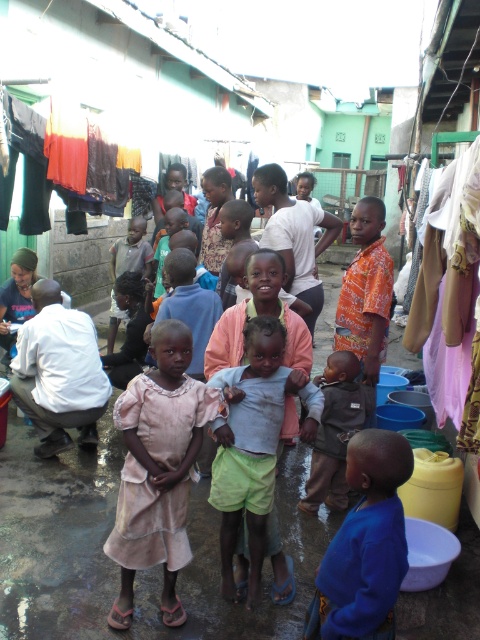
Measure the distance from light green shorts at center to blue cotton shirt at lower right.

light green shorts at center and blue cotton shirt at lower right are 32.95 inches apart from each other.

Who is taller, light green shorts at center or blue cotton shirt at lower right?

Standing taller between the two is light green shorts at center.

What do you see at coordinates (253, 444) in the screenshot?
I see `light green shorts at center` at bounding box center [253, 444].

This screenshot has width=480, height=640. In order to click on light green shorts at center in this screenshot , I will do `click(253, 444)`.

Does light green shorts at center have a smaller size compared to dark gray fabric baby at center?

Yes.

Consider the image. Is light green shorts at center behind dark gray fabric baby at center?

No, light green shorts at center is closer to the viewer.

Does point (252, 497) come in front of point (336, 464)?

Yes, point (252, 497) is closer to viewer.

Identify the location of light green shorts at center. This screenshot has height=640, width=480. (253, 444).

Identify the location of pink fabric dress at center. The height and width of the screenshot is (640, 480). (157, 468).

Between pink fabric dress at center and light pink fabric at center, which one appears on the left side from the viewer's perspective?

From the viewer's perspective, light pink fabric at center appears more on the left side.

Find the location of a particular element. The image size is (480, 640). pink fabric dress at center is located at coordinates (157, 468).

This screenshot has width=480, height=640. Identify the location of pink fabric dress at center. (157, 468).